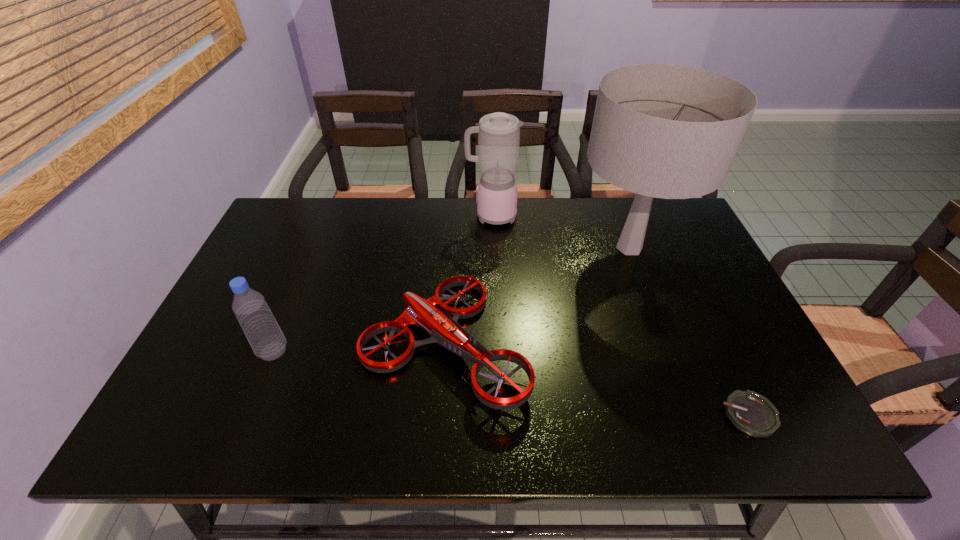
Locate an element on the screen. free point between the leftmost object and the food processor is located at coordinates (382, 284).

Where is `unoccupied position between the lampshade and the fourth shortest object`? unoccupied position between the lampshade and the fourth shortest object is located at coordinates pos(561,232).

The height and width of the screenshot is (540, 960). Find the location of `vacant point located between the ashtray and the food processor`. vacant point located between the ashtray and the food processor is located at coordinates (620, 315).

You are a GUI agent. You are given a task and a screenshot of the screen. Output one action in this format:
    pyautogui.click(x=<x>, y=<y>)
    Task: Click on the vacant space in between the tallest object and the food processor
    This screenshot has height=540, width=960.
    Given the screenshot: What is the action you would take?
    pyautogui.click(x=561, y=232)

Identify the location of vacant area between the shortest object and the food processor. The image size is (960, 540). (620, 315).

At what (x,y) coordinates should I click in order to perform the action: click on vacant region between the tallest object and the shortest object. Please return your answer as a coordinate pair (x, y). Looking at the image, I should click on (689, 331).

At what (x,y) coordinates should I click in order to perform the action: click on object that ranks as the third closest to the tallest object. Please return your answer as a coordinate pair (x, y). Looking at the image, I should click on (750, 412).

Locate an element on the screen. object identified as the second closest to the second shortest object is located at coordinates (257, 321).

Where is `vacant space that satisfies the following two spatial constraints: 1. on the front-facing side of the ashtray; 2. on the right side of the lampshade`? vacant space that satisfies the following two spatial constraints: 1. on the front-facing side of the ashtray; 2. on the right side of the lampshade is located at coordinates (692, 415).